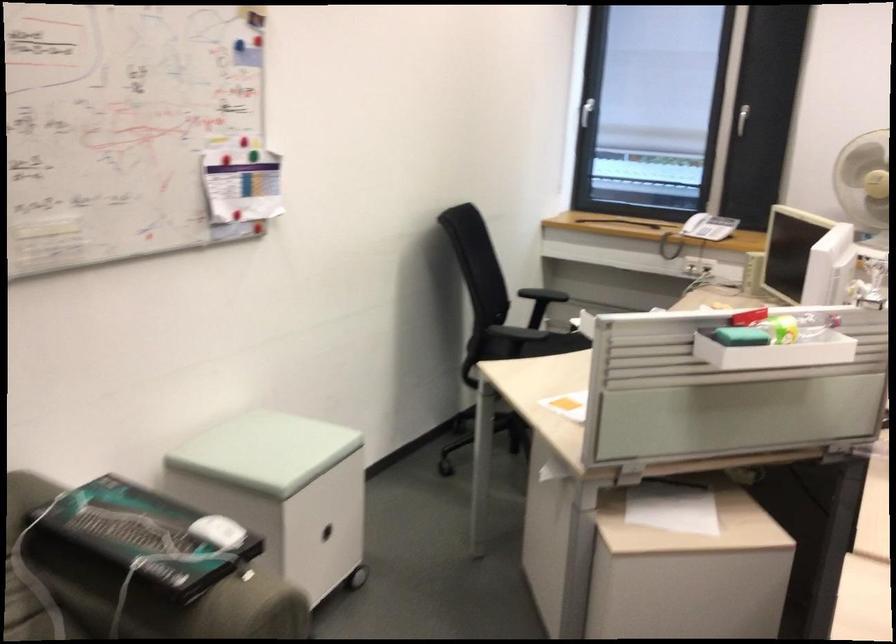
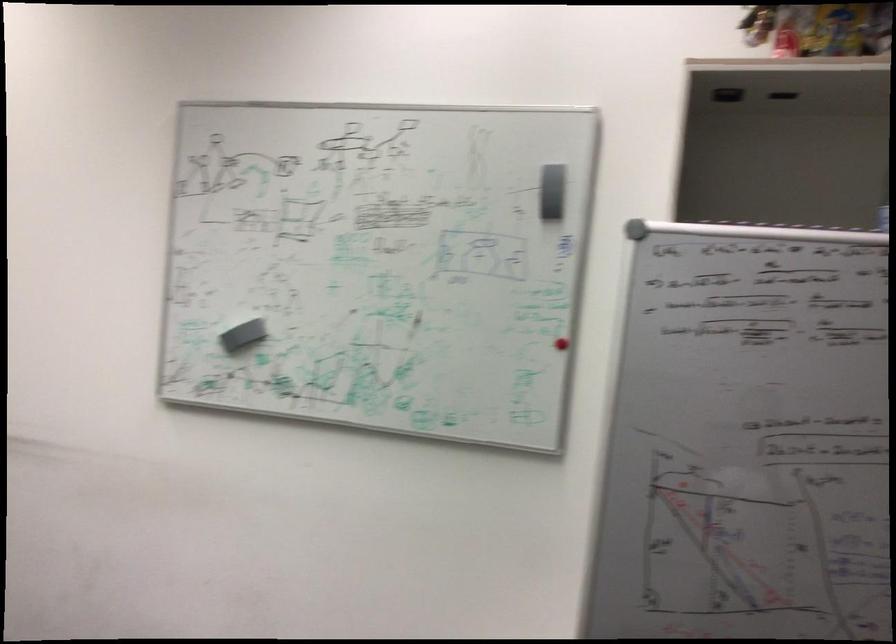
Question: The camera is either moving clockwise (left) or counter-clockwise (right) around the object. The first image is from the beginning of the video and the second image is from the end. Is the camera moving left or right when shooting the video?

Choices:
 (A) Left
 (B) Right

Answer: (A)